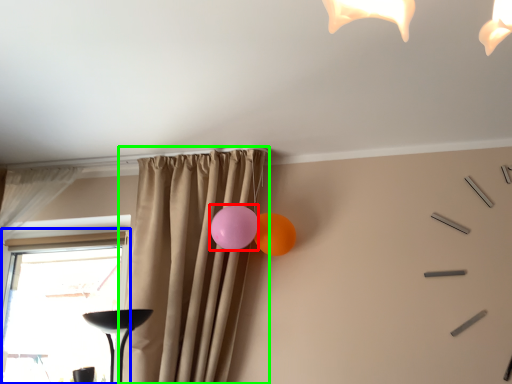
Question: Based on their relative distances, which object is farther from balloon (highlighted by a red box)? Choose from window (highlighted by a blue box) and curtain (highlighted by a green box).

Choices:
 (A) window
 (B) curtain

Answer: (A)